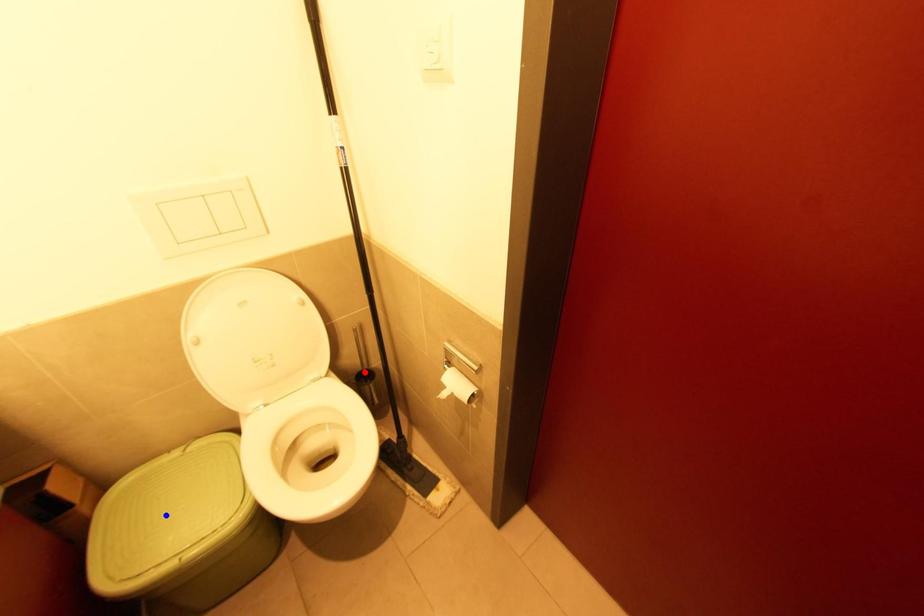
Question: Which of the two points in the image is closer to the camera?

Choices:
 (A) Blue point is closer.
 (B) Red point is closer.

Answer: (A)